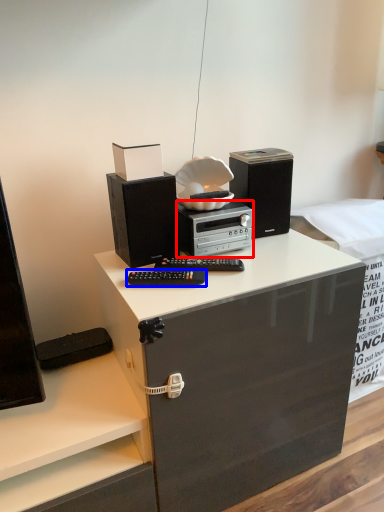
Question: Which object appears closest to the camera in this image, home appliance (highlighted by a red box) or equipment (highlighted by a blue box)?

Choices:
 (A) home appliance
 (B) equipment

Answer: (B)